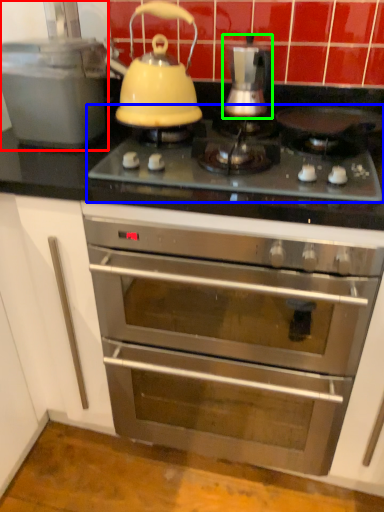
Question: Estimate the real-world distances between objects in this image. Which object is farther from kitchen appliance (highlighted by a red box), gas stove (highlighted by a blue box) or kitchen appliance (highlighted by a green box)?

Choices:
 (A) gas stove
 (B) kitchen appliance

Answer: (B)